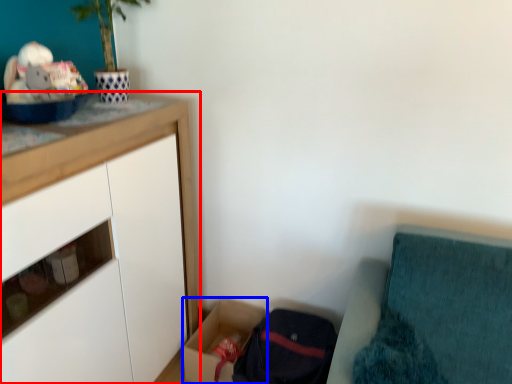
Question: Which object is closer to the camera taking this photo, cabinetry (highlighted by a red box) or storage box (highlighted by a blue box)?

Choices:
 (A) cabinetry
 (B) storage box

Answer: (A)